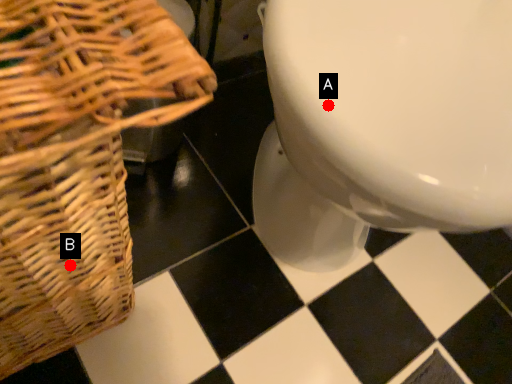
Question: Two points are circled on the image, labeled by A and B beside each circle. Which point is closer to the camera taking this photo?

Choices:
 (A) A is closer
 (B) B is closer

Answer: (A)